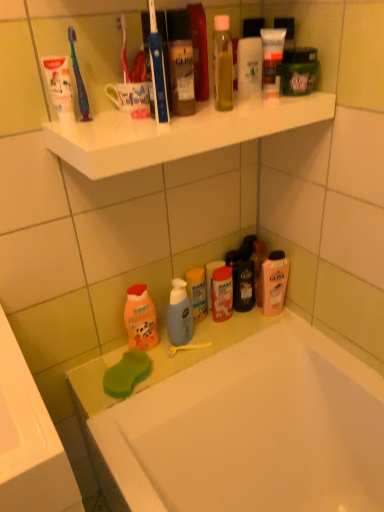
At what (x,y) coordinates should I click in order to perform the action: click on free area in between orange matte bottle at lower left and green sponge at lower left. Please return your answer as a coordinate pair (x, y). Looking at the image, I should click on (147, 358).